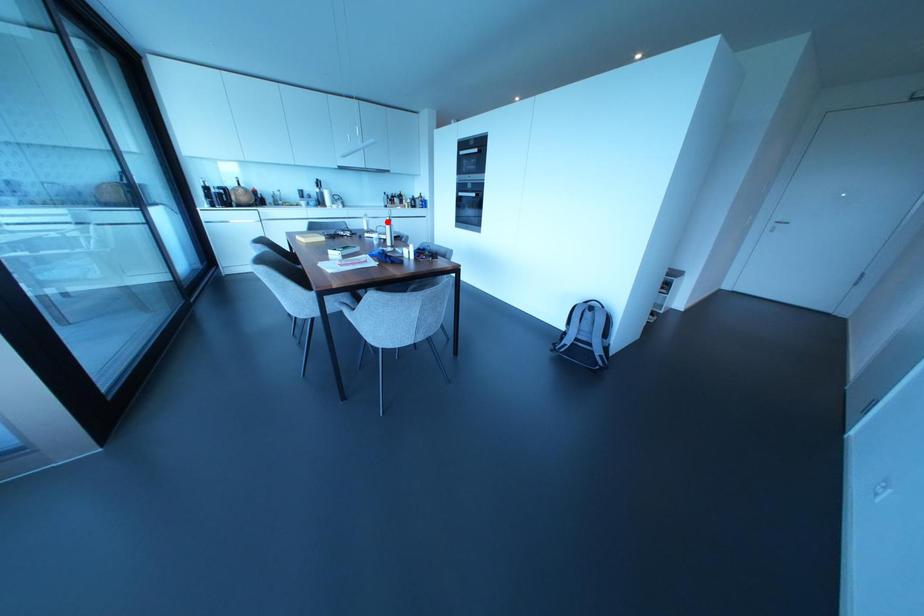
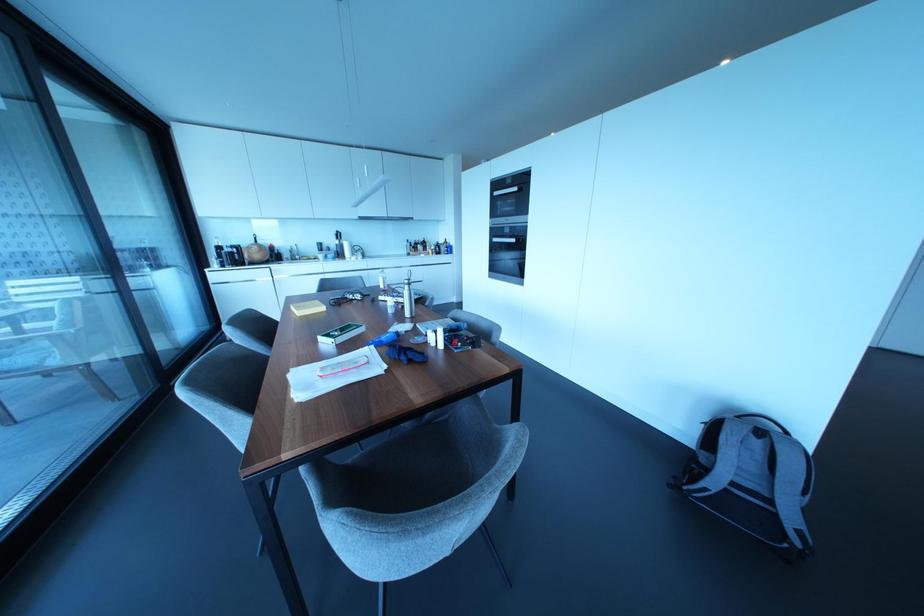
Where in the second image is the point corresponding to the highlighted location from the first image?

(406, 286)